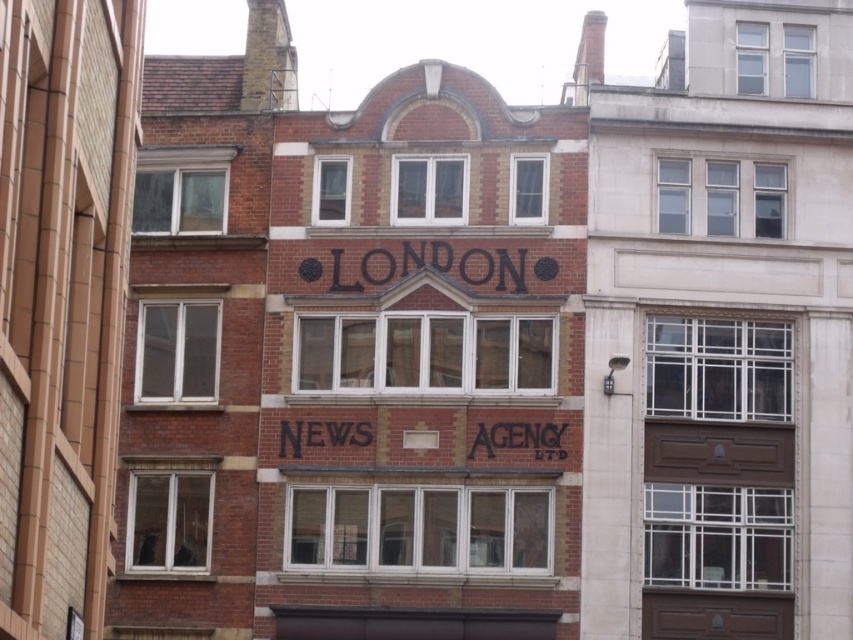
Question: Observing the image, what is the correct spatial positioning of black painted letters at center in reference to black painted sign at center?

Choices:
 (A) below
 (B) above

Answer: (B)

Question: Which point is farther from the camera taking this photo?

Choices:
 (A) (405, 252)
 (B) (509, 438)

Answer: (A)

Question: Which of the following is the farthest from the observer?

Choices:
 (A) black painted sign at center
 (B) black painted letters at center

Answer: (B)

Question: Is black painted letters at center above black painted sign at center?

Choices:
 (A) no
 (B) yes

Answer: (B)

Question: Does black painted letters at center have a larger size compared to black painted sign at center?

Choices:
 (A) yes
 (B) no

Answer: (B)